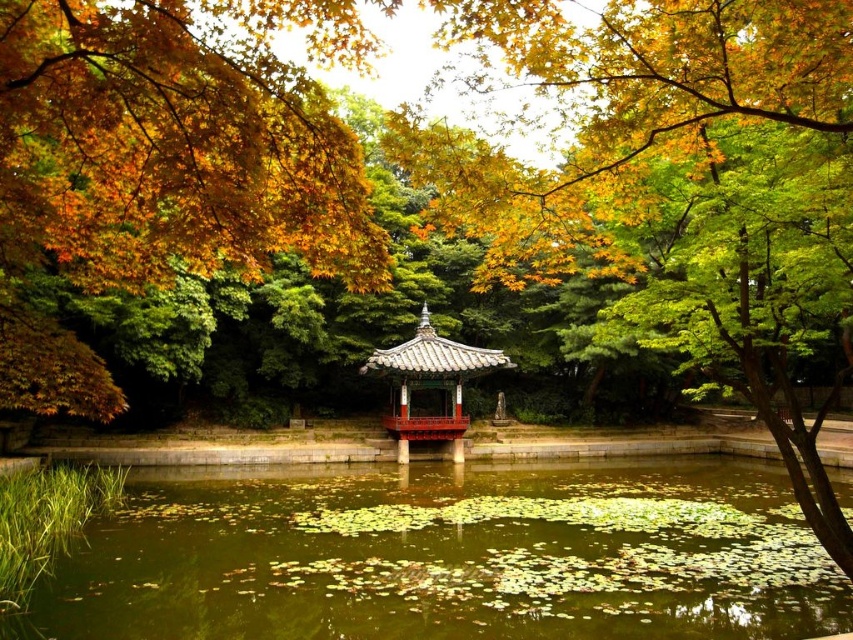
You are a visitor in the garden and want to cross from the left side to the right side of the scene. The path is blocked by the green mossy water at center and the matte black gazebo at center. Which obstacle is wider and therefore harder to bypass?

The green mossy water at center is wider than the matte black gazebo at center, so it is harder to bypass.

You are a visitor in the garden and want to cross from the path to the gazebo. The path is on the edge of the green mossy water at center. Can you step onto the matte black gazebo at center directly from the path without getting your feet wet?

The green mossy water at center is not as tall as the matte black gazebo at center, so the gazebo is higher. Therefore, you can step onto the matte black gazebo at center directly from the path without getting your feet wet.